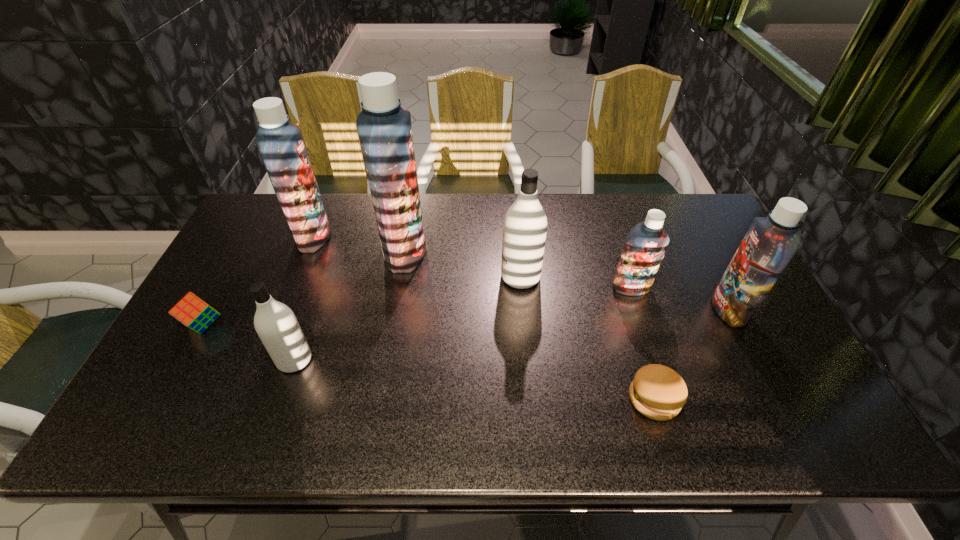
The image size is (960, 540). What are the coordinates of `vacant region between the third biggest blue shampoo and the fourth shampoo from right to left` in the screenshot? It's located at (567, 280).

The height and width of the screenshot is (540, 960). Identify the location of vacant space that is in between the nearest object and the tallest object. (530, 325).

Find the location of a particular element. vacant space in between the left white shampoo and the tallest shampoo is located at coordinates [349, 306].

Where is `vacant space in between the second smallest blue shampoo and the biggest blue shampoo`? The image size is (960, 540). vacant space in between the second smallest blue shampoo and the biggest blue shampoo is located at coordinates (567, 280).

I want to click on unoccupied position between the nearest object and the leftmost object, so click(429, 362).

The image size is (960, 540). I want to click on the seventh closest object to the red cube, so click(770, 243).

You are a GUI agent. You are given a task and a screenshot of the screen. Output one action in this format:
    pyautogui.click(x=<x>, y=<y>)
    Task: Click on the object that is the fourth closest to the fourth shampoo from right to left
    The width and height of the screenshot is (960, 540).
    Given the screenshot: What is the action you would take?
    pyautogui.click(x=193, y=312)

Select which shampoo appears as the second closest to the fifth shampoo from left to right. Please provide its 2D coordinates. Your answer should be formatted as a tuple, i.e. [(x, y)], where the tuple contains the x and y coordinates of a point satisfying the conditions above.

[(525, 224)]

I want to click on the third closest shampoo relative to the fourth shampoo from left to right, so click(x=770, y=243).

You are a GUI agent. You are given a task and a screenshot of the screen. Output one action in this format:
    pyautogui.click(x=<x>, y=<y>)
    Task: Click on the blue shampoo that stands as the closest to the hamburger
    The height and width of the screenshot is (540, 960).
    Given the screenshot: What is the action you would take?
    pyautogui.click(x=770, y=243)